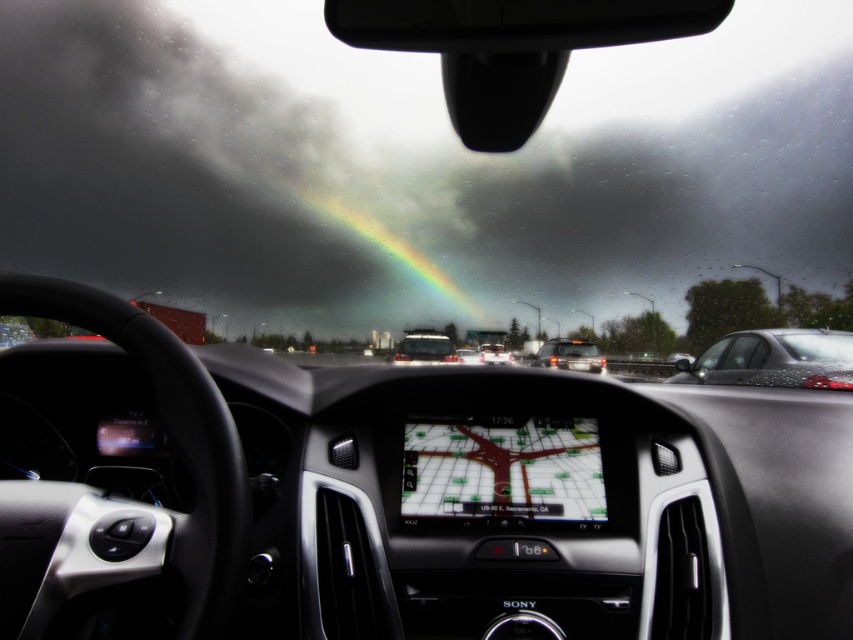
Question: Which object is the closest to the shiny black sedan at right?

Choices:
 (A) matte black bus at center
 (B) matte black sedan at center
 (C) white glossy sedan at center
 (D) satin silver sedan at center

Answer: (A)

Question: Which point appears closest to the camera in this image?

Choices:
 (A) (495, 348)
 (B) (474, 349)
 (C) (375, 228)

Answer: (C)

Question: Is shiny black sedan at right above satin silver sedan at center?

Choices:
 (A) no
 (B) yes

Answer: (B)

Question: Where is matte black bus at center located in relation to white glossy sedan at center in the image?

Choices:
 (A) below
 (B) above

Answer: (B)

Question: Does shiny black sedan at right appear over rainbow at center?

Choices:
 (A) yes
 (B) no

Answer: (B)

Question: Which object appears closest to the camera in this image?

Choices:
 (A) white glossy sedan at center
 (B) satin silver sedan at center
 (C) shiny black sedan at right

Answer: (C)